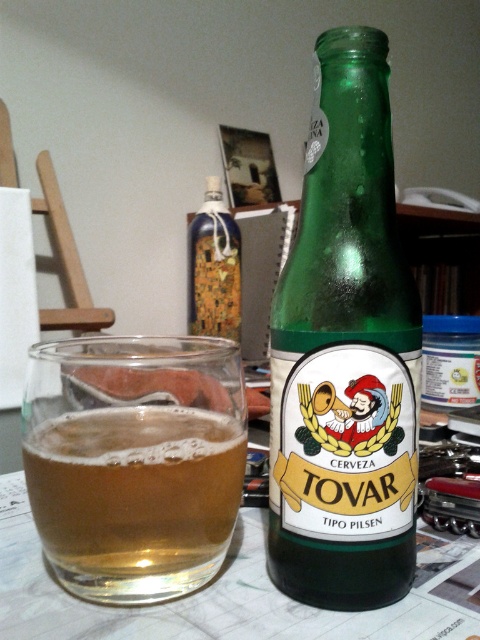
You are a barista who needs to place the green glass bottle at center on a shelf. The shelf has a coordinate system where the bottom left corner is the origin point. The shelf is 1 meter wide and 0.5 meters tall. Can you fit the bottle on the shelf without exceeding the shelf dimensions?

The green glass bottle at center is positioned at point [345,353]. Since the shelf is 1 meter wide and 0.5 meters tall, the bottle would exceed the shelf height as its y coordinate is 0.719 which is taller than 0.5 meters. Therefore, the bottle cannot be placed on the shelf without exceeding the height limit.

Looking at this image, you are arranging drinks on a shelf and see the green glass bottle at center and the blue glass bottle at center. Which one should you place higher on the shelf to match the image?

The blue glass bottle at center should be placed higher because the green glass bottle at center is below it in the image.

You are at a bar and want to pour the beer from the blue glass bottle at center into the transparent glass at center. Considering their sizes, will the glass be able to hold all the beer from the bottle?

The transparent glass at center has a lesser width compared to blue glass bottle at center, so it might not be able to hold all the beer from the bottle since the glass is narrower.